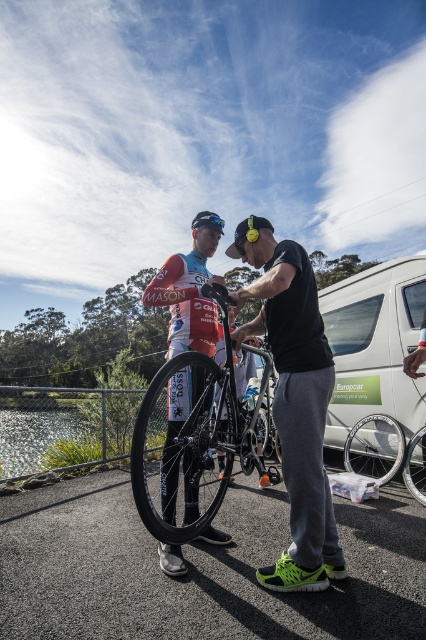
Question: From the image, what is the correct spatial relationship of black matte bicycle at center in relation to white matte van at center?

Choices:
 (A) above
 (B) below

Answer: (A)

Question: Which object appears closest to the camera in this image?

Choices:
 (A) matte black helmet at center
 (B) shiny black frame at center
 (C) black matte bicycle at center
 (D) shiny black bicycle at center

Answer: (C)

Question: Observing the image, what is the correct spatial positioning of black matte bicycle at center in reference to shiny black frame at center?

Choices:
 (A) above
 (B) below

Answer: (A)

Question: Which of these objects is positioned closest to the shiny black frame at center?

Choices:
 (A) white matte van at center
 (B) matte black helmet at center

Answer: (B)

Question: Is shiny black bicycle at center smaller than matte black helmet at center?

Choices:
 (A) yes
 (B) no

Answer: (A)

Question: Which point is farther to the camera?

Choices:
 (A) white matte van at center
 (B) shiny black frame at center
 (C) shiny black bicycle at center
 (D) black matte bicycle at center

Answer: (A)